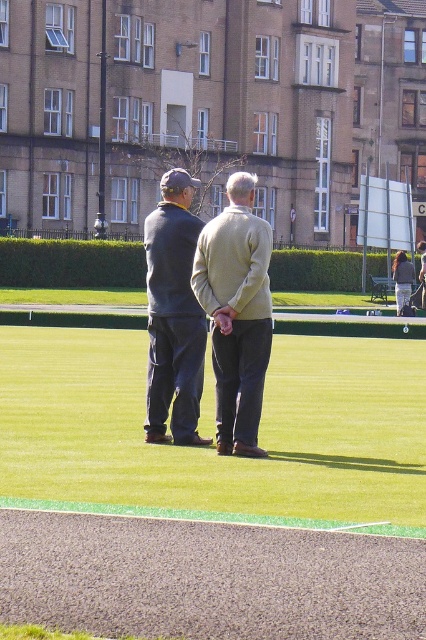
Question: Which object appears closest to the camera in this image?

Choices:
 (A) green grass at center
 (B) light beige sweater at center
 (C) dark blue sweater at center

Answer: (A)

Question: Which of the following is the farthest from the observer?

Choices:
 (A) dark blue sweater at center
 (B) green grass at center

Answer: (A)

Question: Is light beige sweater at center positioned at the back of dark blue sweater at center?

Choices:
 (A) no
 (B) yes

Answer: (A)

Question: Observing the image, what is the correct spatial positioning of light beige sweater at center in reference to dark blue sweater at center?

Choices:
 (A) right
 (B) left

Answer: (A)

Question: Which object is closer to the camera taking this photo?

Choices:
 (A) dark blue sweater at center
 (B) light beige sweater at center

Answer: (B)

Question: Does green grass at center have a smaller size compared to dark blue sweater at center?

Choices:
 (A) yes
 (B) no

Answer: (A)